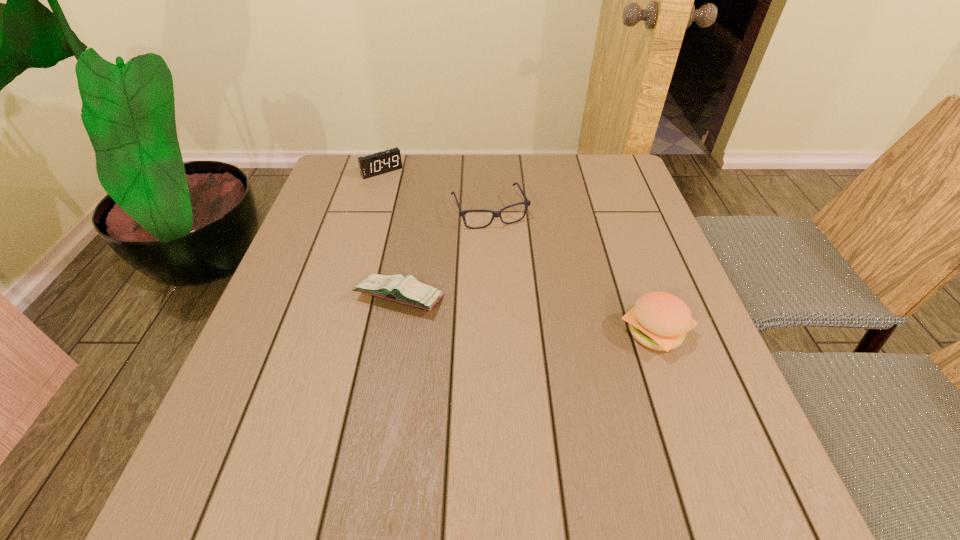
Identify the location of vacant space at the right edge of the desktop. This screenshot has height=540, width=960. (696, 366).

Where is `blank space at the far left corner of the desktop`? The image size is (960, 540). blank space at the far left corner of the desktop is located at coordinates (358, 165).

You are a GUI agent. You are given a task and a screenshot of the screen. Output one action in this format:
    pyautogui.click(x=<x>, y=<y>)
    Task: Click on the free point at the near left corner
    
    Given the screenshot: What is the action you would take?
    pyautogui.click(x=258, y=400)

I want to click on blank space at the far right corner of the desktop, so click(582, 185).

The image size is (960, 540). I want to click on blank space at the near right corner of the desktop, so click(x=709, y=415).

Locate an element on the screen. The height and width of the screenshot is (540, 960). free space between the farthest object and the diary is located at coordinates (391, 234).

The image size is (960, 540). Identify the location of free space between the hamburger and the second farthest object. [572, 271].

Locate an element on the screen. This screenshot has height=540, width=960. vacant area that lies between the tallest object and the alarm clock is located at coordinates (518, 252).

In order to click on vacant space that's between the spectacles and the alarm clock in this screenshot , I will do `click(436, 191)`.

Find the location of a particular element. This screenshot has width=960, height=540. free spot between the alarm clock and the spectacles is located at coordinates (436, 191).